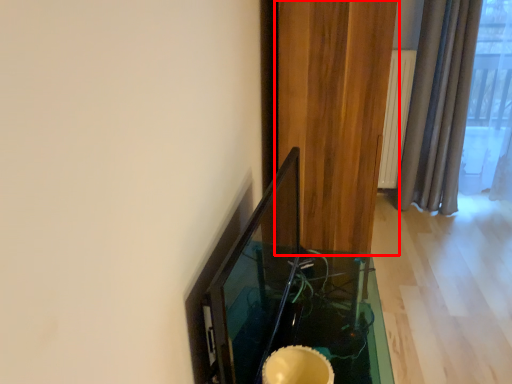
Question: In this image, where is curtain (annotated by the red box) located relative to table?

Choices:
 (A) left
 (B) right

Answer: (B)